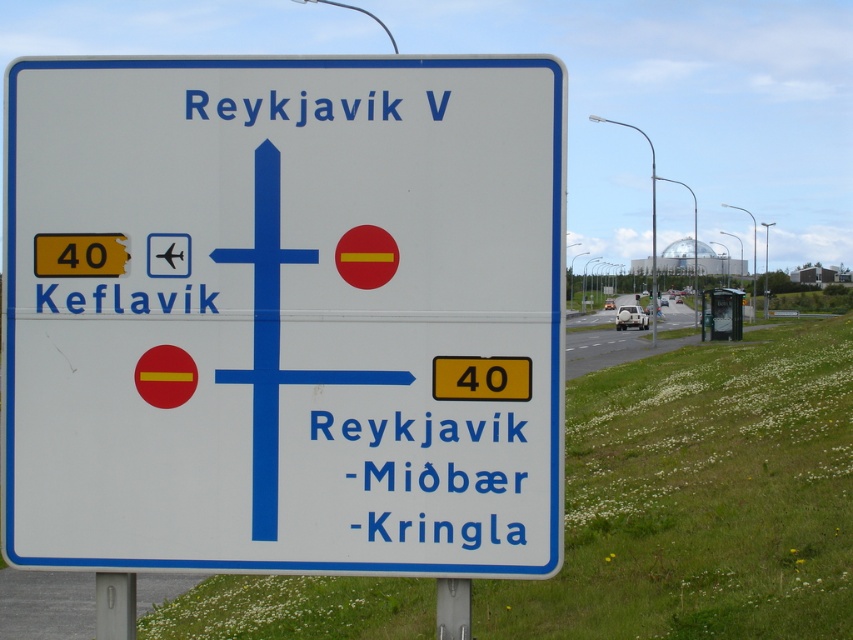
You are a driver approaching the road sign. You see the white plastic sign at center and the black text at lower left. Which object is located lower in the image?

The white plastic sign at center is positioned under the black text at lower left, so the white plastic sign at center is lower in the image.

You are a driver approaching the white plastic sign at center and the blue text at lower center. Which object will you see first as you drive towards them?

You will see the white plastic sign at center first because it is closer to you than the blue text at lower center, which is further away.

You are a driver approaching the white plastic sign at center and the black text at lower left. Which object is taller?

The white plastic sign at center is taller than the black text at lower left.